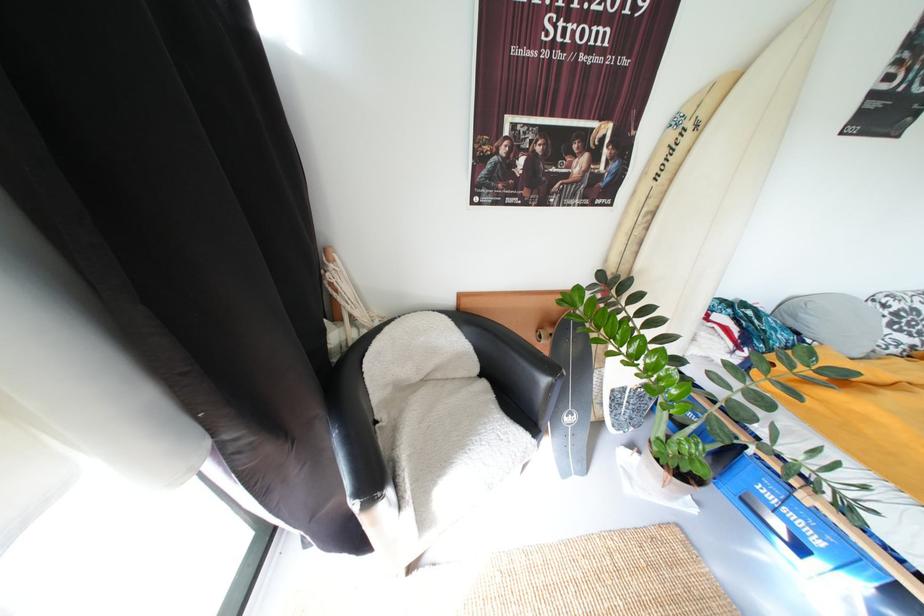
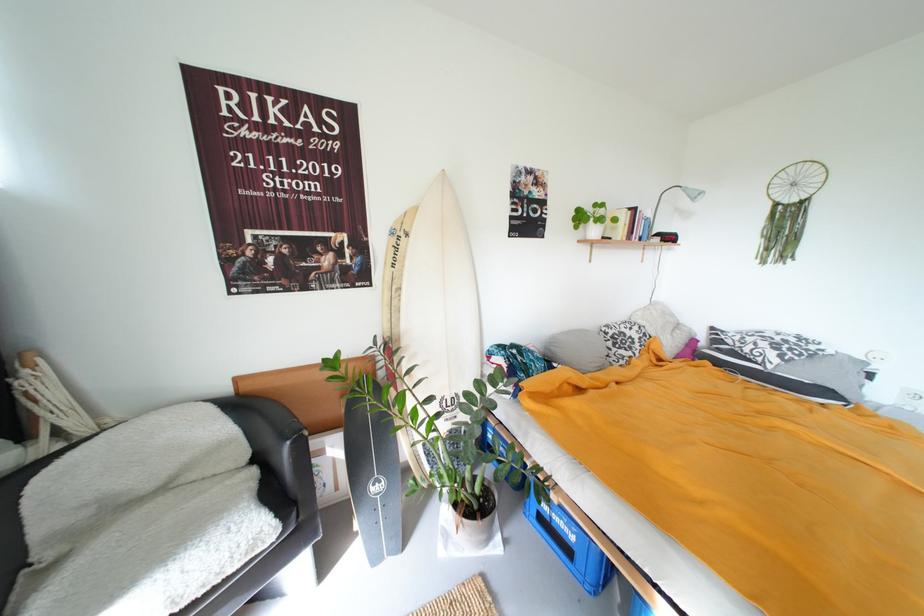
Where in the second image is the point corresponding to the point at 466,310 from the first image?

(246, 395)